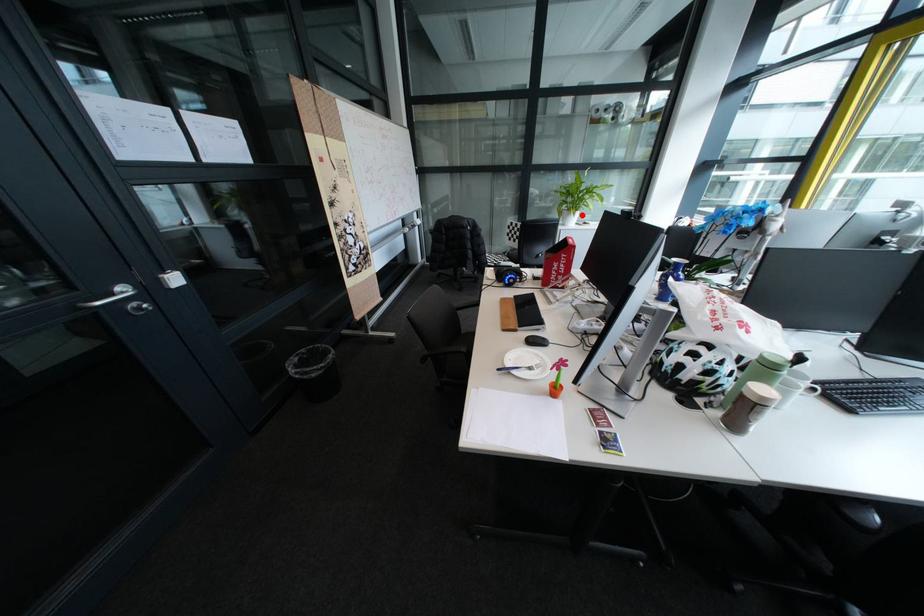
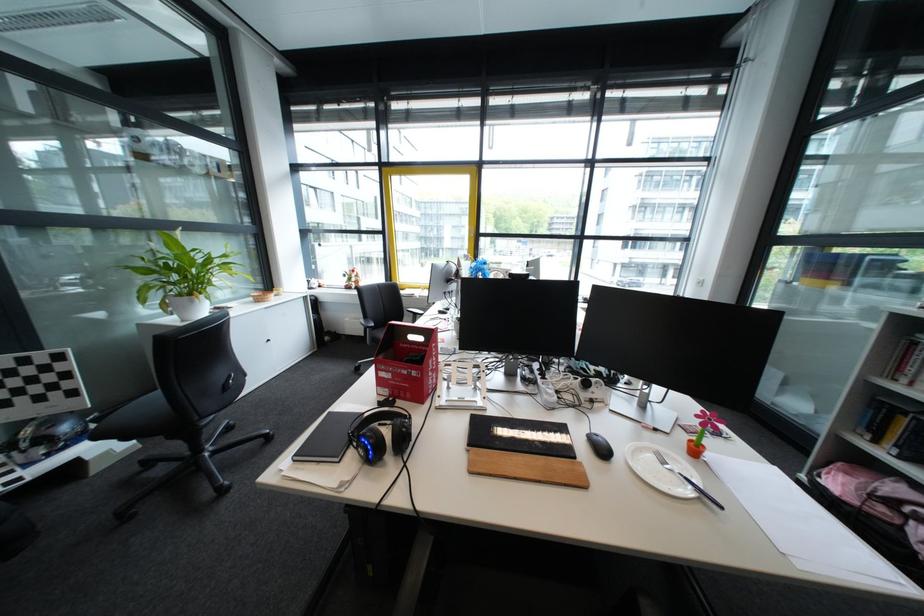
The point at the highlighted location is marked in the first image. Where is the corresponding point in the second image?

(207, 302)